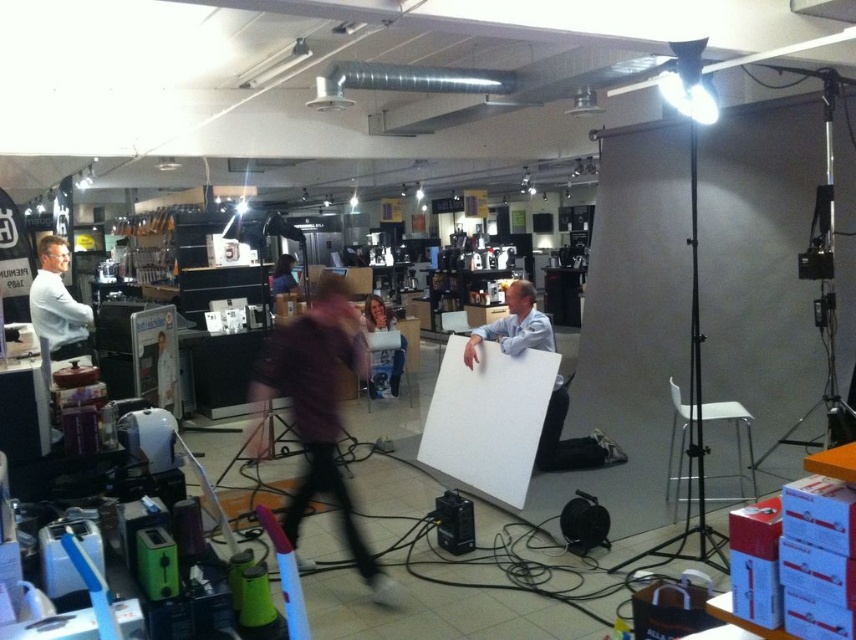
In the image, there are several people in a busy indoor setting. You notice a point at coordinates (57, 305). Which object from the list below is located at that point? Choose from the options below. 1. purple jacketed person walking across frame 2. light colored clothing seated on stool 3. white shirt at left

The point (57, 305) is on the white shirt at left.

You are a photographer setting up equipment in the described scene. You need to place a camera stand that requires 2 meters of space between the purple fabric at center and the white matte desk at center. Is there enough space available?

The purple fabric at center is 1.40 meters away from the white matte desk at center. Since the required space is 2 meters, there is not enough space available for the camera stand.